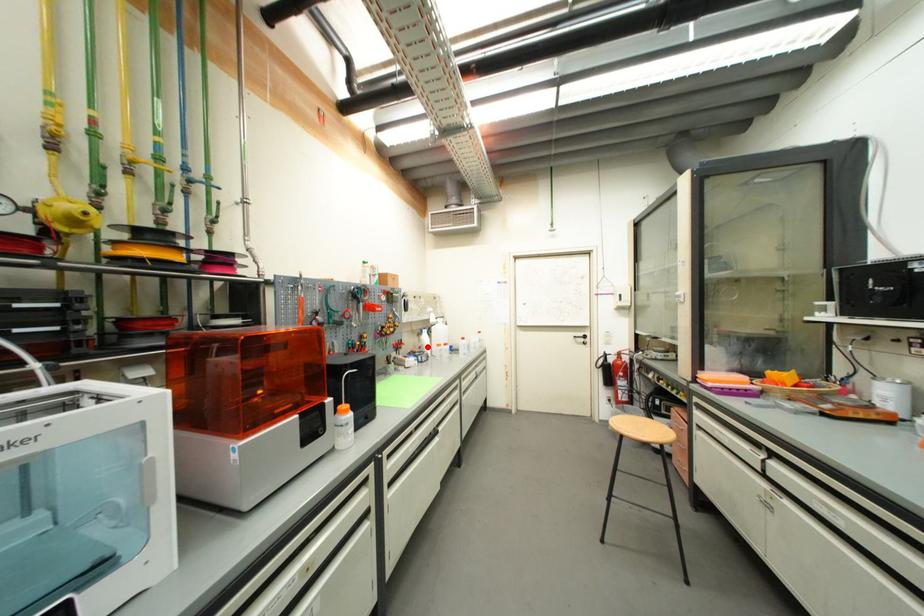
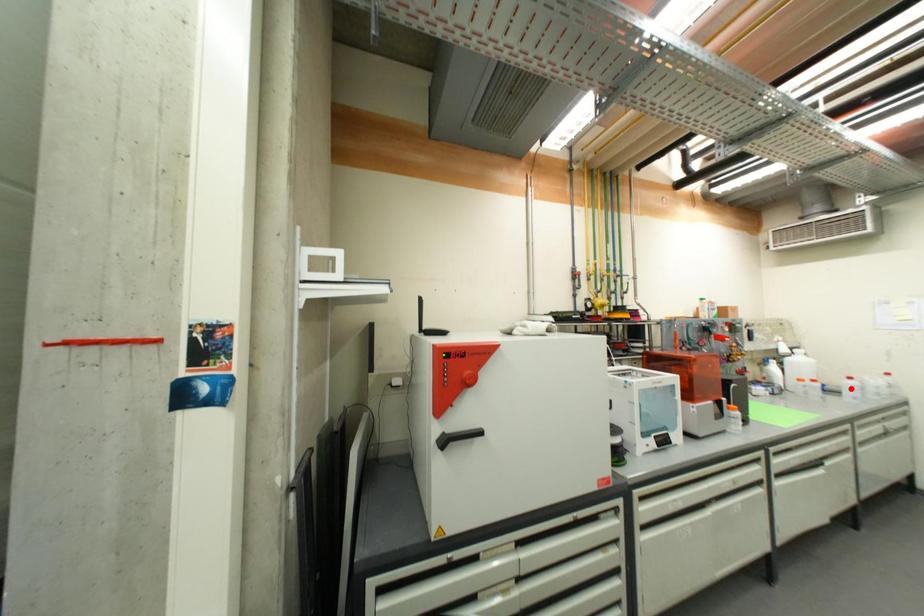
I am providing you with two images of the same scene from different viewpoints. A red point is marked on the first image and another point is marked on the second image. Do the highlighted points in image1 and image2 indicate the same real-world spot?

No